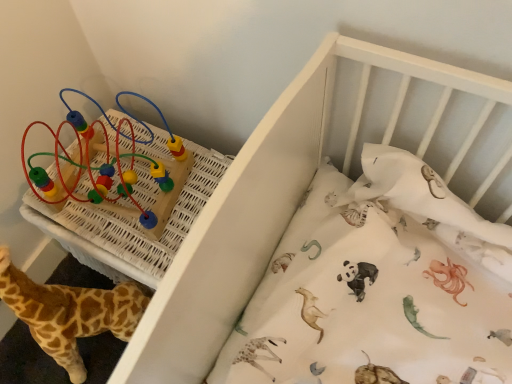
Question: Could multicolored plastic beads at upper left be considered to be inside soft plush giraffe at lower left?

Choices:
 (A) no
 (B) yes

Answer: (A)

Question: Considering the relative positions of soft plush giraffe at lower left and multicolored plastic beads at upper left in the image provided, is soft plush giraffe at lower left to the left of multicolored plastic beads at upper left from the viewer's perspective?

Choices:
 (A) no
 (B) yes

Answer: (B)

Question: From a real-world perspective, is soft plush giraffe at lower left located beneath multicolored plastic beads at upper left?

Choices:
 (A) yes
 (B) no

Answer: (A)

Question: Is soft plush giraffe at lower left looking in the opposite direction of multicolored plastic beads at upper left?

Choices:
 (A) yes
 (B) no

Answer: (A)

Question: Is soft plush giraffe at lower left positioned before multicolored plastic beads at upper left?

Choices:
 (A) no
 (B) yes

Answer: (B)

Question: Is point (166, 144) positioned closer to the camera than point (49, 309)?

Choices:
 (A) farther
 (B) closer

Answer: (A)

Question: Is multicolored plastic beads at upper left inside or outside of soft plush giraffe at lower left?

Choices:
 (A) inside
 (B) outside

Answer: (B)

Question: Is multicolored plastic beads at upper left taller or shorter than soft plush giraffe at lower left?

Choices:
 (A) tall
 (B) short

Answer: (B)

Question: From the image's perspective, relative to soft plush giraffe at lower left, is multicolored plastic beads at upper left above or below?

Choices:
 (A) above
 (B) below

Answer: (A)

Question: Is white wooden crib at upper center to the left or to the right of soft plush giraffe at lower left in the image?

Choices:
 (A) left
 (B) right

Answer: (B)

Question: From the image's perspective, relative to soft plush giraffe at lower left, is white wooden crib at upper center above or below?

Choices:
 (A) above
 (B) below

Answer: (A)

Question: Do you think white wooden crib at upper center is within soft plush giraffe at lower left, or outside of it?

Choices:
 (A) outside
 (B) inside

Answer: (A)

Question: In terms of width, does white wooden crib at upper center look wider or thinner when compared to soft plush giraffe at lower left?

Choices:
 (A) wide
 (B) thin

Answer: (A)

Question: Would you say soft plush giraffe at lower left is to the left or to the right of white wooden crib at upper center in the picture?

Choices:
 (A) left
 (B) right

Answer: (A)

Question: Is soft plush giraffe at lower left inside the boundaries of white wooden crib at upper center, or outside?

Choices:
 (A) inside
 (B) outside

Answer: (B)